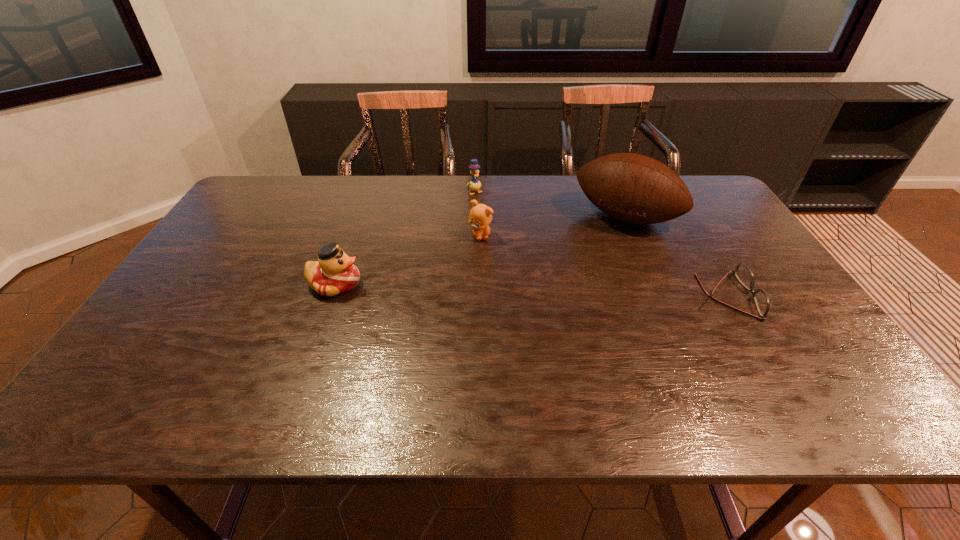
Find the location of a particular element. Image resolution: width=960 pixels, height=540 pixels. free space on the desktop that is between the leftmost object and the shortest object and is positioned on the laces of the football is located at coordinates (579, 292).

You are a GUI agent. You are given a task and a screenshot of the screen. Output one action in this format:
    pyautogui.click(x=<x>, y=<y>)
    Task: Click on the vacant space on the desktop that is between the duck and the shortest object and is positioned on the face of the duckling, where the monocle is placed
    
    Given the screenshot: What is the action you would take?
    [550, 291]

The image size is (960, 540). Identify the location of vacant space on the desktop that is between the duck and the shortest object and is positioned on the face of the teddy bear. (497, 289).